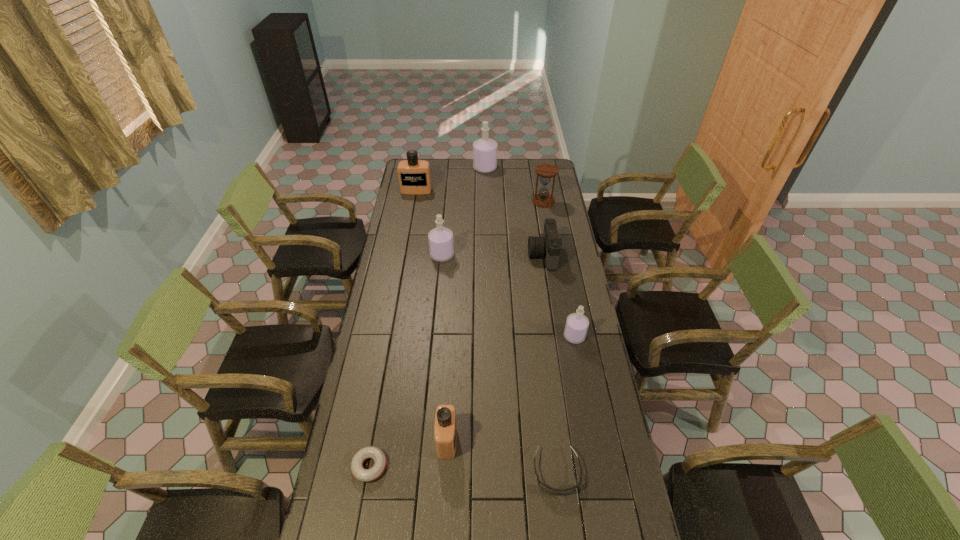
Identify the location of the biggest purple perfume. (485, 149).

At what (x,y) coordinates should I click in order to perform the action: click on the fifth object from right to left. Please return your answer as a coordinate pair (x, y). Looking at the image, I should click on (485, 149).

What are the coordinates of `the leftmost purple perfume` in the screenshot? It's located at (441, 246).

The width and height of the screenshot is (960, 540). I want to click on the second smallest purple perfume, so click(x=441, y=246).

What are the coordinates of `the left beige perfume` in the screenshot? It's located at (414, 177).

What are the coordinates of `the farther beige perfume` in the screenshot? It's located at (414, 177).

I want to click on hourglass, so click(546, 171).

You are a GUI agent. You are given a task and a screenshot of the screen. Output one action in this format:
    pyautogui.click(x=<x>, y=<y>)
    Task: Click on the nearest perfume
    
    Given the screenshot: What is the action you would take?
    pyautogui.click(x=445, y=432)

At what (x,y) coordinates should I click in order to perform the action: click on the smaller beige perfume. Please return your answer as a coordinate pair (x, y). This screenshot has height=540, width=960. Looking at the image, I should click on (445, 432).

Identify the location of the nearest purple perfume. (576, 327).